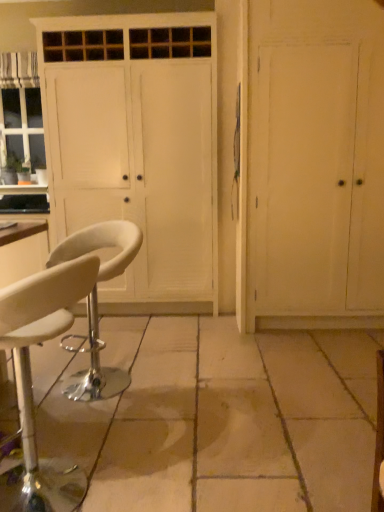
Locate an element on the screen. The image size is (384, 512). vacant space that is in between white leather stool at lower left, placed as the 1th chair when sorted from front to back, and white leather stool at lower left, the second chair from the front is located at coordinates (93, 415).